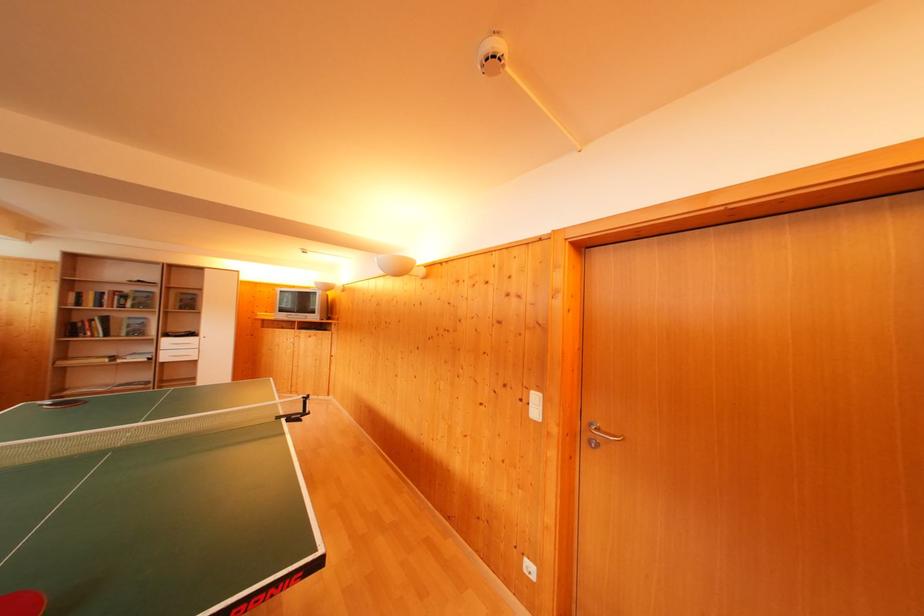
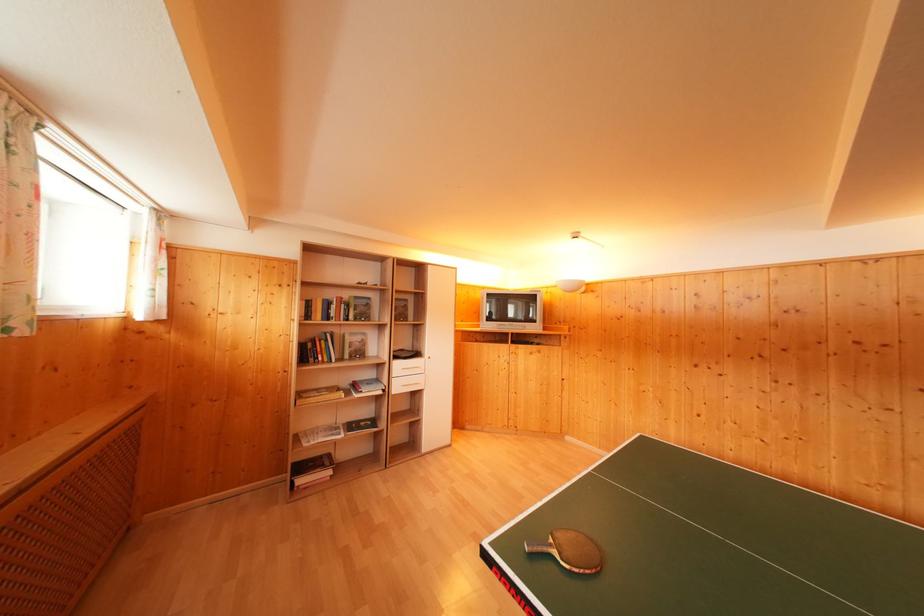
Question: I am providing you with two images of the same scene from different viewpoints. Please identify which objects are invisible in image2.

Choices:
 (A) white drawer handle
 (B) hardcover book
 (C) ping pong paddle
 (D) none of these

Answer: (D)